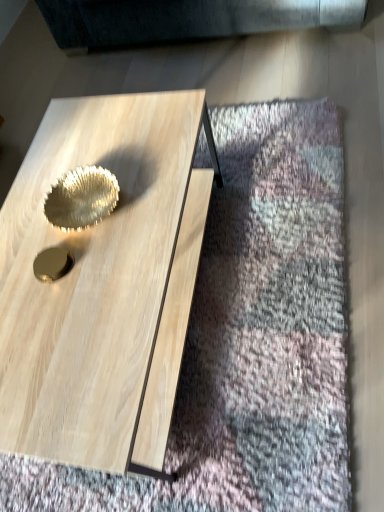
Question: Is shiny metallic bowl at center bigger or smaller than natural wood coffee table at center?

Choices:
 (A) big
 (B) small

Answer: (B)

Question: In the image, is shiny metallic bowl at center positioned in front of or behind natural wood coffee table at center?

Choices:
 (A) behind
 (B) front

Answer: (A)

Question: From a real-world perspective, is shiny metallic bowl at center positioned above or below natural wood coffee table at center?

Choices:
 (A) above
 (B) below

Answer: (A)

Question: Looking at the image, does natural wood coffee table at center seem bigger or smaller compared to shiny metallic bowl at center?

Choices:
 (A) small
 (B) big

Answer: (B)

Question: Considering the relative positions of natural wood coffee table at center and shiny metallic bowl at center in the image provided, is natural wood coffee table at center to the left or to the right of shiny metallic bowl at center?

Choices:
 (A) left
 (B) right

Answer: (B)

Question: Is point (74, 106) positioned closer to the camera than point (84, 203)?

Choices:
 (A) farther
 (B) closer

Answer: (A)

Question: Is natural wood coffee table at center inside or outside of shiny metallic bowl at center?

Choices:
 (A) inside
 (B) outside

Answer: (B)